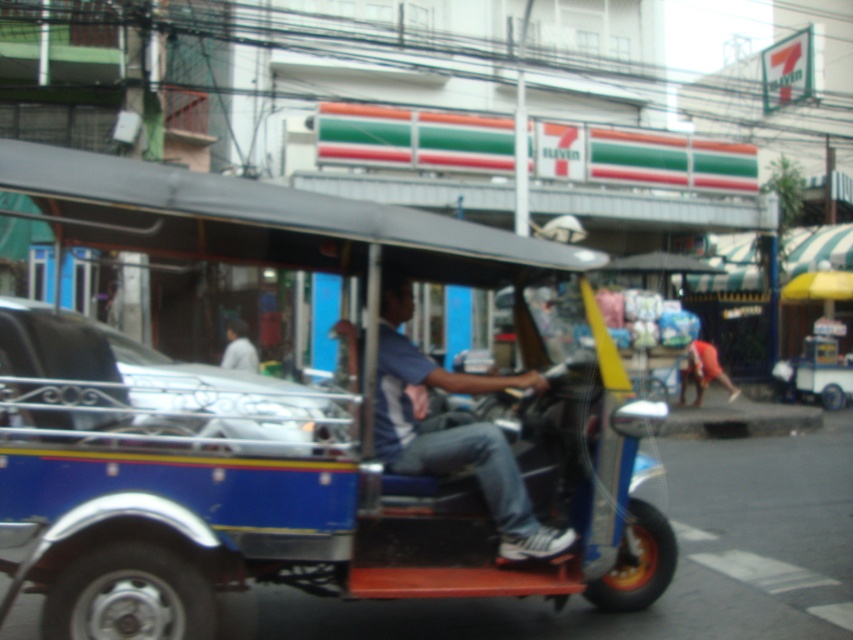
Question: Which of the following is the farthest from the observer?

Choices:
 (A) metallic silver car at center
 (B) blue denim jeans at center
 (C) blue metallic tricycle at center
 (D) red fabric shirt at lower right

Answer: (D)

Question: Does red fabric shirt at lower right appear over light gray fabric shirt at center?

Choices:
 (A) yes
 (B) no

Answer: (B)

Question: Which is farther from the metallic silver car at center?

Choices:
 (A) blue denim jeans at center
 (B) blue metallic tricycle at center

Answer: (B)

Question: From the image, what is the correct spatial relationship of metallic silver car at center in relation to red fabric shirt at lower right?

Choices:
 (A) right
 (B) left

Answer: (B)

Question: Which of these objects is positioned farthest from the red fabric shirt at lower right?

Choices:
 (A) metallic silver car at center
 (B) blue metallic tricycle at center

Answer: (A)

Question: In this image, where is blue metallic tricycle at center located relative to blue denim jeans at center?

Choices:
 (A) above
 (B) below

Answer: (A)